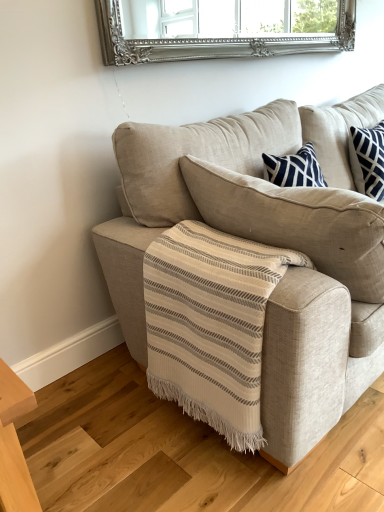
Question: From a real-world perspective, is wooden floor at lower left under beige fabric couch at center?

Choices:
 (A) yes
 (B) no

Answer: (A)

Question: Considering the relative sizes of wooden floor at lower left and beige fabric couch at center in the image provided, is wooden floor at lower left thinner than beige fabric couch at center?

Choices:
 (A) yes
 (B) no

Answer: (B)

Question: Does wooden floor at lower left appear on the left side of beige fabric couch at center?

Choices:
 (A) no
 (B) yes

Answer: (B)

Question: Considering the relative sizes of wooden floor at lower left and beige fabric couch at center in the image provided, is wooden floor at lower left taller than beige fabric couch at center?

Choices:
 (A) no
 (B) yes

Answer: (A)

Question: From a real-world perspective, is wooden floor at lower left over beige fabric couch at center?

Choices:
 (A) no
 (B) yes

Answer: (A)

Question: Is beige fabric couch at center at the back of wooden floor at lower left?

Choices:
 (A) yes
 (B) no

Answer: (A)

Question: Is beige fabric couch at center bigger than wooden floor at lower left?

Choices:
 (A) yes
 (B) no

Answer: (A)

Question: Can you confirm if beige fabric couch at center is positioned to the right of wooden floor at lower left?

Choices:
 (A) yes
 (B) no

Answer: (A)

Question: Is beige fabric couch at center positioned in front of wooden floor at lower left?

Choices:
 (A) no
 (B) yes

Answer: (A)

Question: Can you confirm if beige fabric couch at center is wider than wooden floor at lower left?

Choices:
 (A) yes
 (B) no

Answer: (B)

Question: Is beige fabric couch at center taller than wooden floor at lower left?

Choices:
 (A) no
 (B) yes

Answer: (B)

Question: Considering the relative sizes of beige fabric couch at center and wooden floor at lower left in the image provided, is beige fabric couch at center smaller than wooden floor at lower left?

Choices:
 (A) yes
 (B) no

Answer: (B)

Question: In the image, is beige fabric couch at center positioned in front of or behind wooden floor at lower left?

Choices:
 (A) behind
 (B) front

Answer: (A)